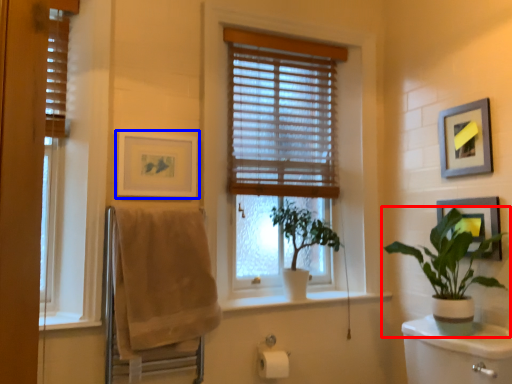
Question: Among these objects, which one is nearest to the camera, houseplant (highlighted by a red box) or picture frame (highlighted by a blue box)?

Choices:
 (A) houseplant
 (B) picture frame

Answer: (A)